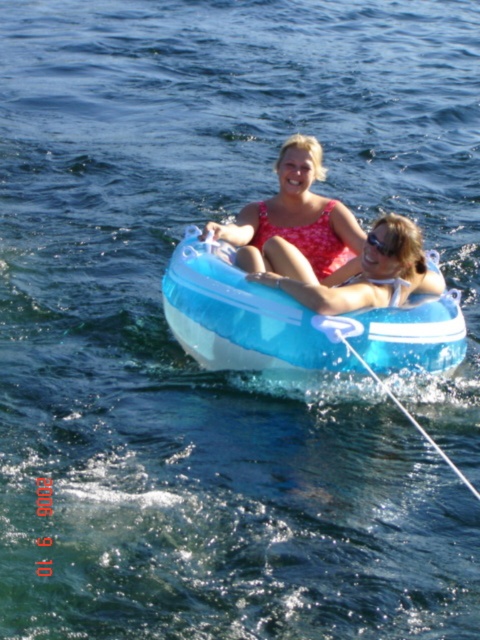
Question: Which of these objects is positioned closest to the translucent blue tube at center?

Choices:
 (A) floral swimsuit at center
 (B) matte blue tube at center

Answer: (B)

Question: In this image, where is floral swimsuit at center located relative to matte blue tube at center?

Choices:
 (A) below
 (B) above

Answer: (B)

Question: Which object appears farthest from the camera in this image?

Choices:
 (A) floral swimsuit at center
 (B) translucent blue tube at center

Answer: (A)

Question: Which point is farther to the camera?

Choices:
 (A) translucent blue tube at center
 (B) floral swimsuit at center
 (C) matte blue tube at center

Answer: (B)

Question: Can you confirm if translucent blue tube at center is bigger than matte blue tube at center?

Choices:
 (A) yes
 (B) no

Answer: (A)

Question: Is translucent blue tube at center to the left of matte blue tube at center from the viewer's perspective?

Choices:
 (A) no
 (B) yes

Answer: (B)